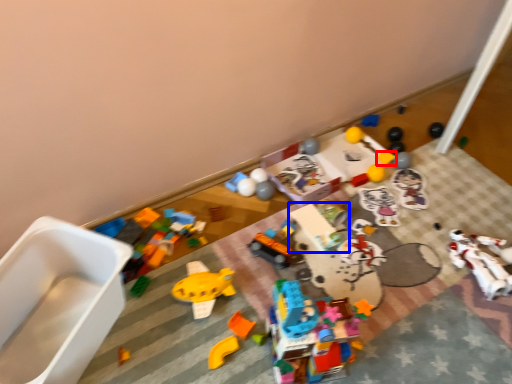
Question: Which point is further to the camera, toy (highlighted by a red box) or toy (highlighted by a blue box)?

Choices:
 (A) toy
 (B) toy

Answer: (A)